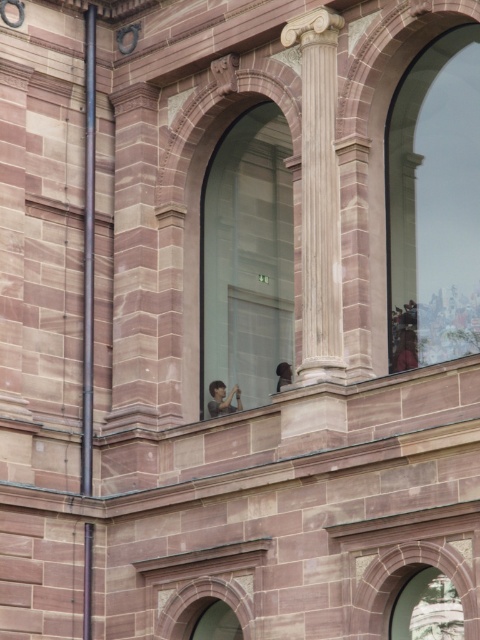
You are standing in front of the classical building and want to determine the relative positions of two points marked on the structure. Which of the two points, point 1 at coordinates (317, 115) or point 2 at coordinates (91, 257), is closer to you?

Point 1 at coordinates (317, 115) is closer to the viewer than point 2 at coordinates (91, 257).

You are an architect designing a new building inspired by classical architecture. You need to decide whether the polished stone column at center and the smooth stone pole at left can fit through a standard doorway that is 1 meter wide. Based on their widths, can both items pass through the doorway?

The polished stone column at center might be wider than smooth stone pole at left. Since the doorway is 1 meter wide, the smooth stone pole at left can pass through, but the polished stone column at center may not fit if it exceeds the doorway width.